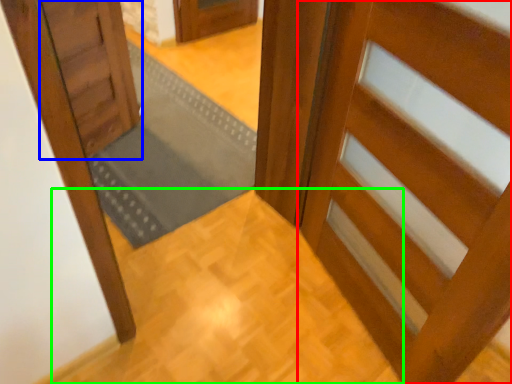
Question: Which is nearer to the door (highlighted by a red box)? door (highlighted by a blue box) or path (highlighted by a green box).

Choices:
 (A) door
 (B) path

Answer: (B)